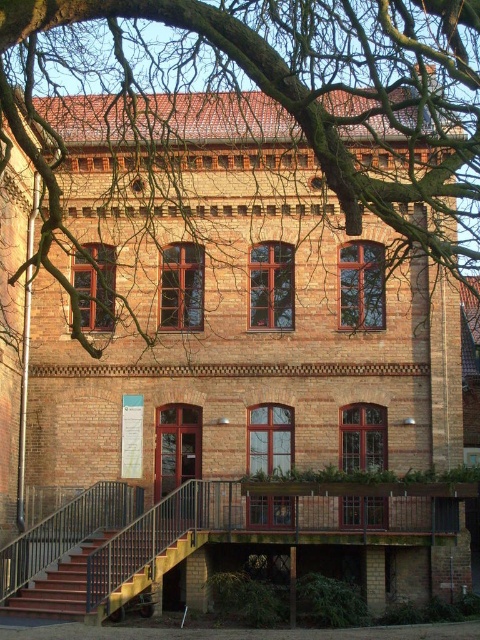
How distant is bare branches at center from wooden stairs at lower left?

bare branches at center and wooden stairs at lower left are 23.75 meters apart from each other.

Does point (147, 20) come behind point (81, 557)?

Yes, it is behind point (81, 557).

The height and width of the screenshot is (640, 480). I want to click on bare branches at center, so click(x=289, y=92).

You are a GUI agent. You are given a task and a screenshot of the screen. Output one action in this format:
    pyautogui.click(x=<x>, y=<y>)
    Task: Click on the bare branches at center
    
    Given the screenshot: What is the action you would take?
    pyautogui.click(x=289, y=92)